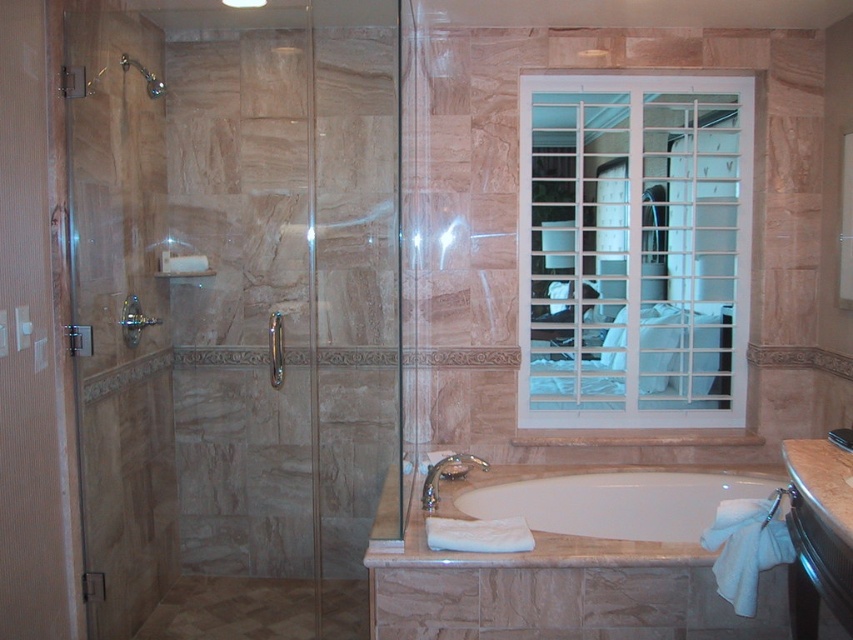
Question: Can you confirm if transparent glass shower door at left is positioned to the right of white glossy bathtub at center?

Choices:
 (A) no
 (B) yes

Answer: (A)

Question: Among these objects, which one is nearest to the camera?

Choices:
 (A) transparent glass shower door at left
 (B) brushed metal showerhead at upper left

Answer: (A)

Question: Can you confirm if transparent glass shower door at left is thinner than brushed metal showerhead at upper left?

Choices:
 (A) no
 (B) yes

Answer: (A)

Question: Based on their relative distances, which object is nearer to the transparent glass shower door at left?

Choices:
 (A) white grid window at upper center
 (B) clear glass door at left
 (C) brushed metal showerhead at upper left
 (D) white glossy bathtub at center

Answer: (B)

Question: Does clear glass door at left appear on the left side of brushed metal showerhead at upper left?

Choices:
 (A) no
 (B) yes

Answer: (B)

Question: Which object appears closest to the camera in this image?

Choices:
 (A) brushed metal showerhead at upper left
 (B) transparent glass shower door at left
 (C) white glossy bathtub at center
 (D) clear glass door at left

Answer: (D)